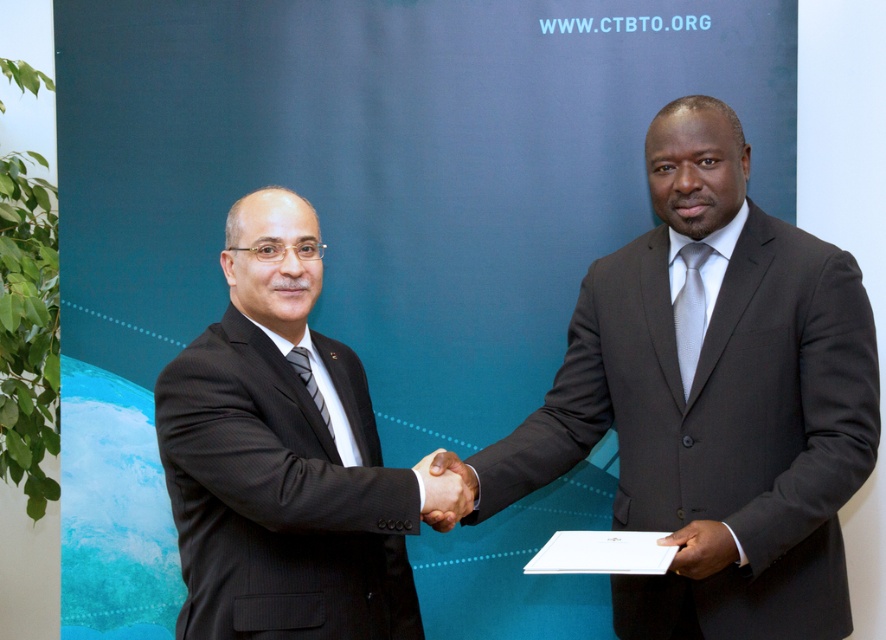
Question: Which object appears closest to the camera in this image?

Choices:
 (A) dark gray suit at center
 (B) black matte hand at center

Answer: (A)

Question: In this image, where is black matte hand at center located relative to smooth white paper at center?

Choices:
 (A) above
 (B) below

Answer: (A)

Question: Which is farther from the smooth white paper at center?

Choices:
 (A) black matte hand at center
 (B) black suit at center
 (C) dark gray suit at center

Answer: (B)

Question: Among these points, which one is farthest from the camera?

Choices:
 (A) (759, 470)
 (B) (717, 570)
 (C) (440, 506)
 (D) (241, 380)

Answer: (A)

Question: Is black suit at center below black matte hand at center?

Choices:
 (A) no
 (B) yes

Answer: (A)

Question: Is dark gray suit at center wider than black suit at center?

Choices:
 (A) yes
 (B) no

Answer: (A)